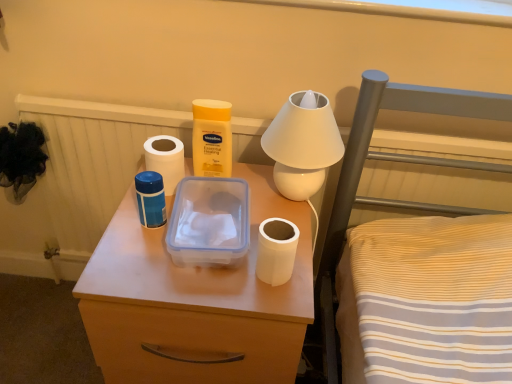
The height and width of the screenshot is (384, 512). Identify the location of vacant area that is in front of white matte toilet paper at center, which appears as the 1th toilet paper when viewed from the front. (270, 307).